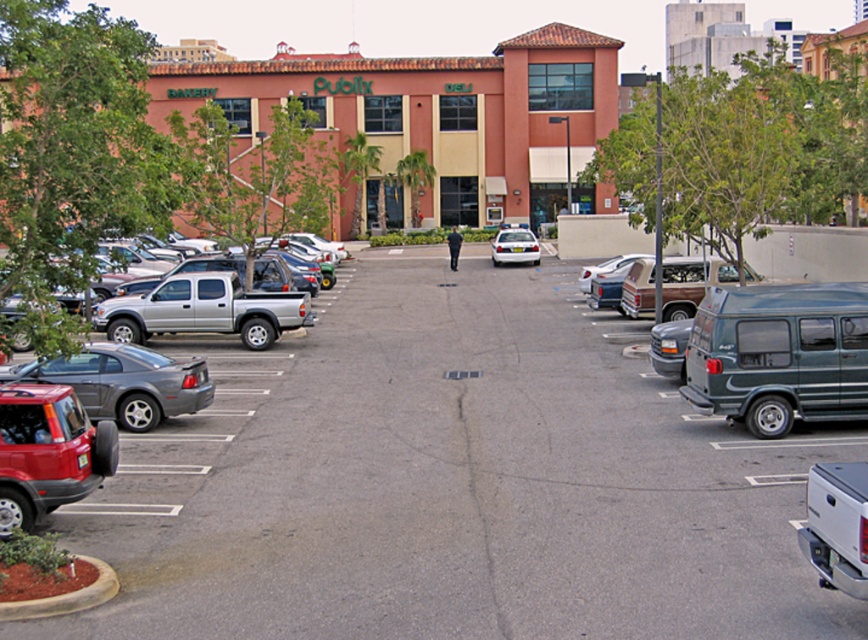
Which of these two, matte red suv at left or white glossy sedan at center, stands taller?

matte red suv at left is taller.

Is matte red suv at left to the left of white glossy sedan at center from the viewer's perspective?

Correct, you'll find matte red suv at left to the left of white glossy sedan at center.

Between point (24, 376) and point (515, 250), which one is positioned in front?

Point (24, 376) is more forward.

Locate an element on the screen. matte red suv at left is located at coordinates pyautogui.click(x=168, y=355).

Between gray asphalt parking lot at center and white glossy sedan at center, which one is positioned lower?

gray asphalt parking lot at center

Between gray asphalt parking lot at center and white glossy sedan at center, which one has less height?

With less height is white glossy sedan at center.

This screenshot has height=640, width=868. In order to click on gray asphalt parking lot at center in this screenshot , I will do `click(452, 481)`.

This screenshot has height=640, width=868. In order to click on gray asphalt parking lot at center in this screenshot , I will do point(452,481).

Is green matte van at right smaller than shiny red suv at lower left?

Actually, green matte van at right might be larger than shiny red suv at lower left.

Consider the image. Which is below, green matte van at right or shiny red suv at lower left?

shiny red suv at lower left

Identify the location of green matte van at right. The height and width of the screenshot is (640, 868). (779, 355).

At what (x,y) coordinates should I click in order to perform the action: click on green matte van at right. Please return your answer as a coordinate pair (x, y). Looking at the image, I should click on (779, 355).